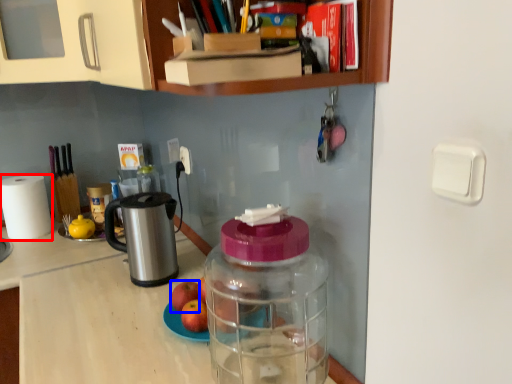
Question: Among these objects, which one is nearest to the camera, paper towel (highlighted by a red box) or apple (highlighted by a blue box)?

Choices:
 (A) paper towel
 (B) apple

Answer: (B)